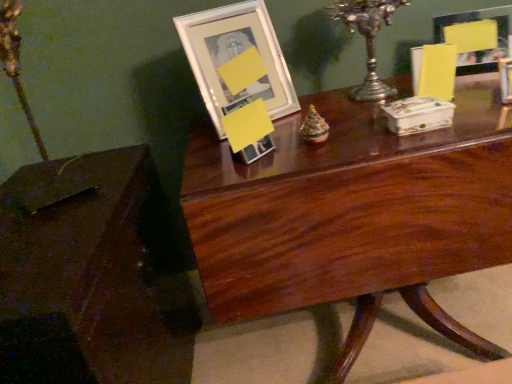
Where is `free space in front of white glossy picture frame at upper center, placed as the 2th picture frame when sorted from right to left`? free space in front of white glossy picture frame at upper center, placed as the 2th picture frame when sorted from right to left is located at coordinates (265, 142).